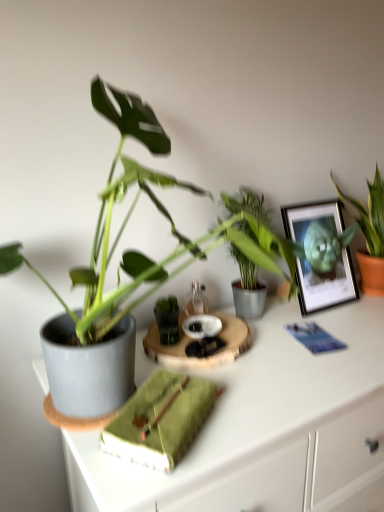
At what (x,y) coordinates should I click in order to perform the action: click on free point above matte gray pot at left (from a real-world perspective). Please return your answer as a coordinate pair (x, y). The image size is (384, 512). Looking at the image, I should click on (301, 347).